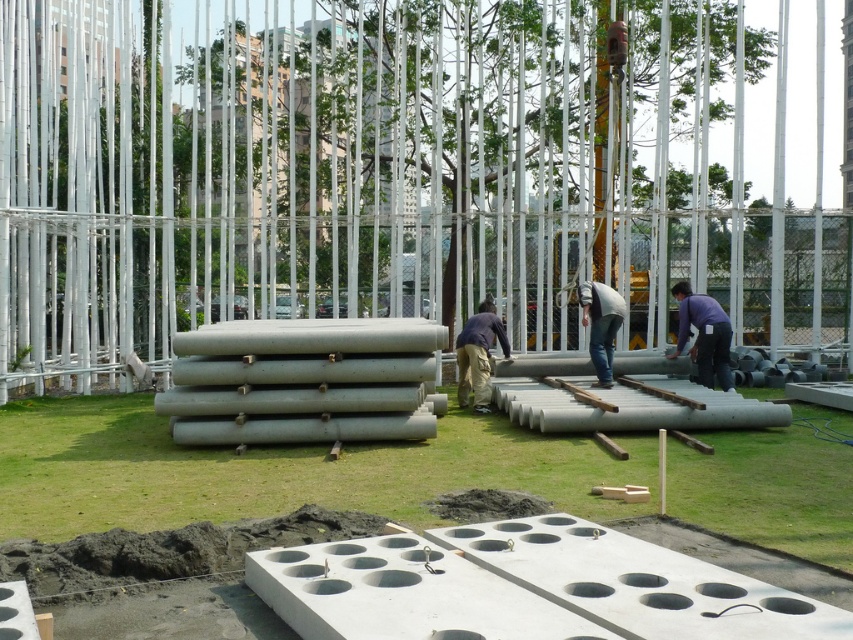
Question: Where is green grass at center located in relation to purple matte shirt at center in the image?

Choices:
 (A) above
 (B) below

Answer: (B)

Question: Which point is closer to the camera?

Choices:
 (A) (596, 369)
 (B) (479, 387)
 (C) (70, 502)

Answer: (C)

Question: Which object appears closest to the camera in this image?

Choices:
 (A) dark blue shirt at center
 (B) green grass at center
 (C) purple matte shirt at center
 (D) gray matte concrete at center

Answer: (B)

Question: Can you confirm if purple matte shirt at center is bigger than gray matte concrete at center?

Choices:
 (A) no
 (B) yes

Answer: (B)

Question: Can you confirm if gray concrete at center is positioned to the left of dark blue shirt at center?

Choices:
 (A) no
 (B) yes

Answer: (B)

Question: Which point is farther to the camera?

Choices:
 (A) green grass at center
 (B) purple matte shirt at center
 (C) dark blue shirt at center

Answer: (B)